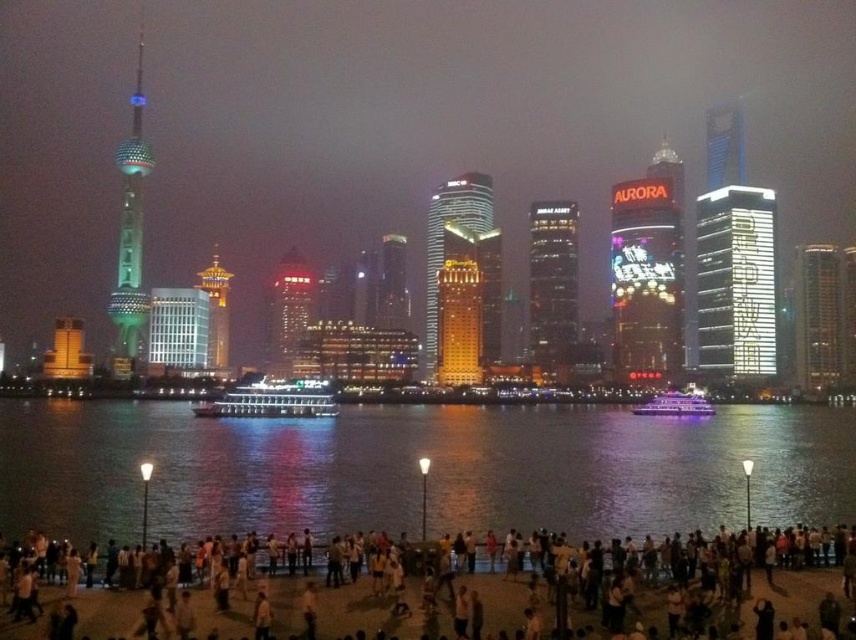
Question: Among these objects, which one is farthest from the camera?

Choices:
 (A) matte gold building at center
 (B) shiny glass skyscraper at upper right

Answer: (B)

Question: Which of the following is the closest to the observer?

Choices:
 (A) white glass skyscraper at right
 (B) clear water at lower center
 (C) neon illuminated sign at center
 (D) metallic glass skyscraper at right

Answer: (B)

Question: Which of these objects is positioned farthest from the matte gold building at center?

Choices:
 (A) golden glass tower at center
 (B) shiny glass skyscraper at upper right

Answer: (B)

Question: Is clear water at lower center to the left of green glass sphere at left from the viewer's perspective?

Choices:
 (A) yes
 (B) no

Answer: (B)

Question: Can you confirm if white casual clothing at lower center is smaller than neon illuminated sign at center?

Choices:
 (A) yes
 (B) no

Answer: (A)

Question: Is the position of neon illuminated sign at center less distant than that of matte gold building at center?

Choices:
 (A) no
 (B) yes

Answer: (A)